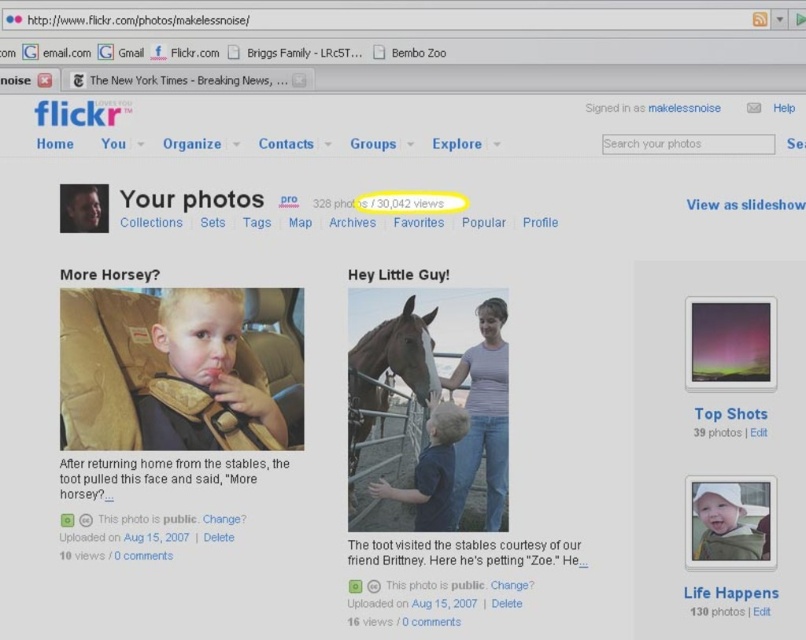
Question: Which object appears farthest from the camera in this image?

Choices:
 (A) brown glossy horse at center
 (B) blue matte shirt at center
 (C) blonde hair baby at center
 (D) white plastic sign at upper center

Answer: (A)

Question: Which object is farther from the camera taking this photo?

Choices:
 (A) white plastic sign at upper center
 (B) blonde hair baby at center

Answer: (B)

Question: Which point appears farthest from the camera in this image?

Choices:
 (A) (767, 307)
 (B) (422, 368)

Answer: (B)

Question: Is blonde hair baby at center behind brown glossy horse at center?

Choices:
 (A) no
 (B) yes

Answer: (A)

Question: From the image, what is the correct spatial relationship of brown glossy horse at center in relation to blue matte shirt at center?

Choices:
 (A) left
 (B) right

Answer: (A)

Question: Is blonde hair baby at center smaller than brown glossy horse at center?

Choices:
 (A) no
 (B) yes

Answer: (B)